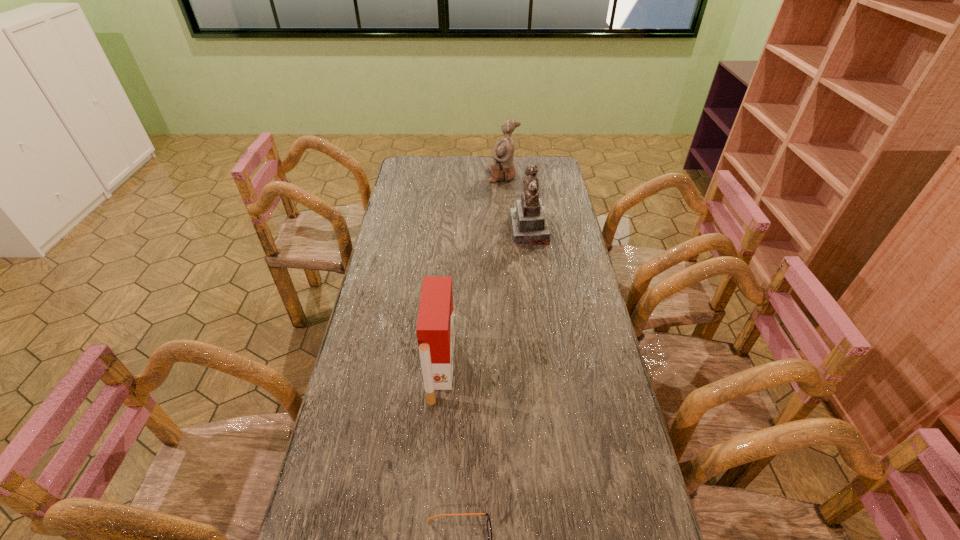
Find the location of a particular element. the farthest object is located at coordinates (502, 169).

Image resolution: width=960 pixels, height=540 pixels. What are the coordinates of `the third nearest object` in the screenshot? It's located at (529, 223).

You are a GUI agent. You are given a task and a screenshot of the screen. Output one action in this format:
    pyautogui.click(x=<x>, y=<y>)
    Task: Click on the cigarette case
    This screenshot has width=960, height=540.
    Given the screenshot: What is the action you would take?
    pyautogui.click(x=435, y=329)

At what (x,y) coordinates should I click in order to perform the action: click on vacant space located 0.300m on the front-facing side of the farthest object. Please return your answer as a coordinate pair (x, y). Looking at the image, I should click on pyautogui.click(x=424, y=176).

The image size is (960, 540). In order to click on vacant space situated 0.110m on the front-facing side of the farthest object in this screenshot , I will do `click(465, 176)`.

Identify the location of free spot located on the front-facing side of the farthest object. (454, 176).

At what (x,y) coordinates should I click in order to perform the action: click on vacant space located 0.270m on the front-facing side of the nearer figurine. Please return your answer as a coordinate pair (x, y). This screenshot has height=540, width=960. Looking at the image, I should click on (444, 230).

Where is `vacant position located 0.210m on the front-facing side of the nearer figurine`? This screenshot has width=960, height=540. vacant position located 0.210m on the front-facing side of the nearer figurine is located at coordinates (460, 230).

This screenshot has height=540, width=960. Identify the location of free space located 0.070m on the front-facing side of the nearer figurine. (494, 230).

Where is `free spot located on the front-facing side of the cigarette case`? This screenshot has width=960, height=540. free spot located on the front-facing side of the cigarette case is located at coordinates (545, 368).